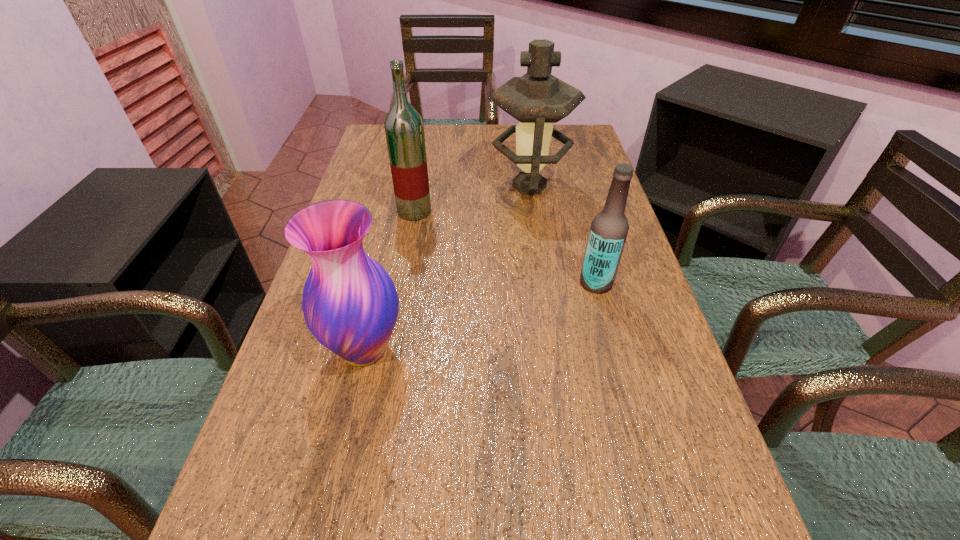
The width and height of the screenshot is (960, 540). What are the coordinates of `liquor that is positioned at the left edge` in the screenshot? It's located at (404, 129).

Find the location of `vase situated at the left edge`. vase situated at the left edge is located at coordinates (350, 304).

Where is `oil lamp that is at the right edge`? The width and height of the screenshot is (960, 540). oil lamp that is at the right edge is located at coordinates (537, 99).

Image resolution: width=960 pixels, height=540 pixels. Identify the location of beer bottle that is at the right edge. (609, 229).

Find the location of a particular element. Image resolution: width=960 pixels, height=540 pixels. free region at the left edge is located at coordinates (368, 182).

In the image, there is a desktop. What are the coordinates of `free space at the right edge` in the screenshot? It's located at (593, 168).

At what (x,y) coordinates should I click in order to perform the action: click on vacant area that lies between the oil lamp and the second nearest object. Please return your answer as a coordinate pair (x, y). The width and height of the screenshot is (960, 540). Looking at the image, I should click on (563, 234).

Locate an element on the screen. Image resolution: width=960 pixels, height=540 pixels. free space between the nearest object and the third farthest object is located at coordinates (480, 316).

Identify the location of vacant space that's between the nearest object and the beer bottle. This screenshot has width=960, height=540. (480, 316).

Identify the location of vacant area that lies between the third farthest object and the liquor. pyautogui.click(x=505, y=247).